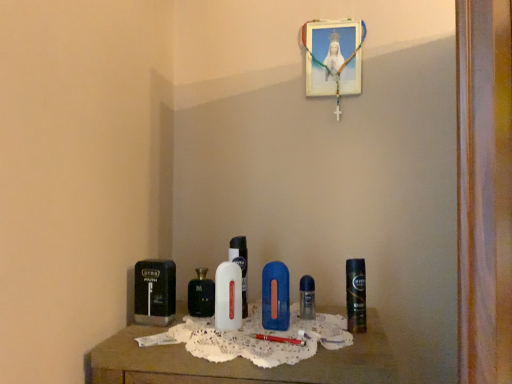
Identify the location of vacant area that is situated to the right of white glossy bottle at center, positioned as the 2th perfume in left-to-right order. (295, 333).